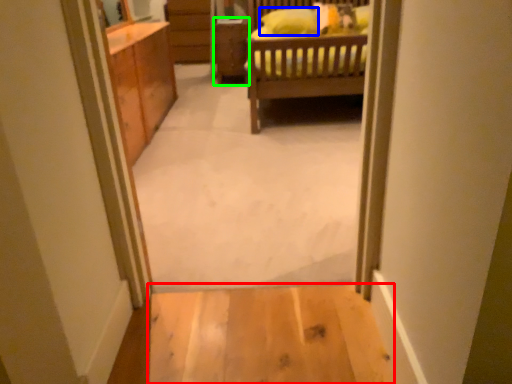
Question: Which object is the closest to the plain (highlighted by a red box)? Choose among these: pillow (highlighted by a blue box) or cabinetry (highlighted by a green box).

Choices:
 (A) pillow
 (B) cabinetry

Answer: (A)